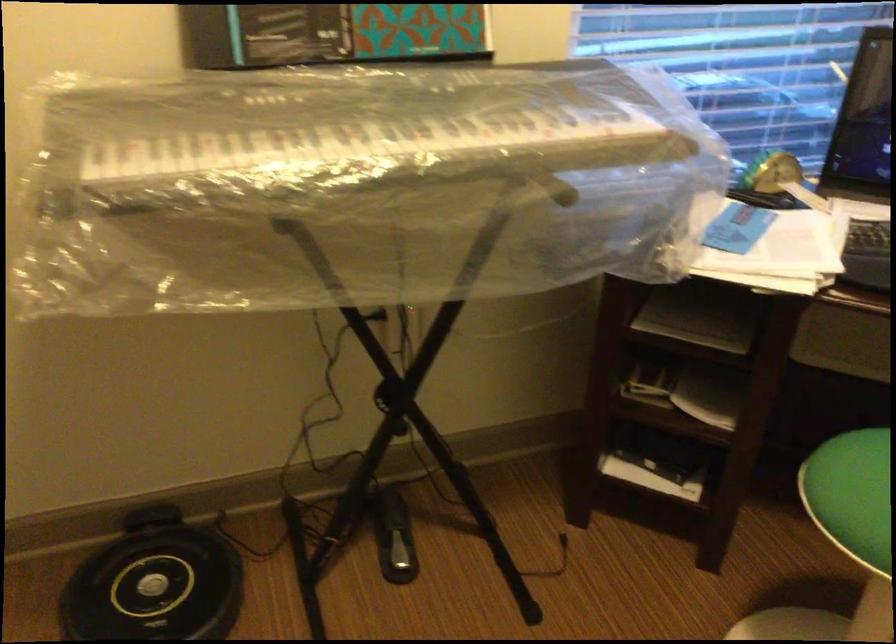
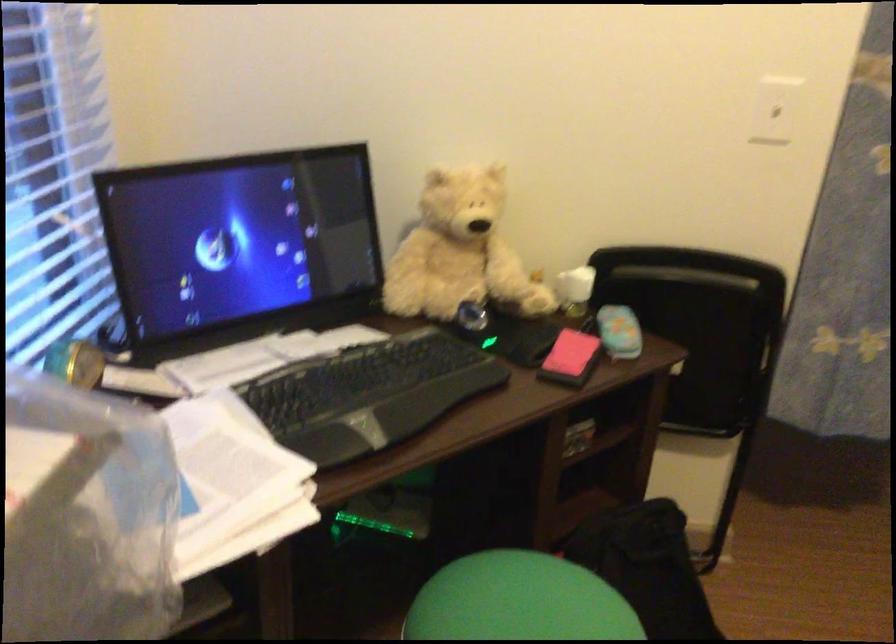
Question: The first image is from the beginning of the video and the second image is from the end. How did the camera likely rotate when shooting the video?

Choices:
 (A) Left
 (B) Right
 (C) Up
 (D) Down

Answer: (B)